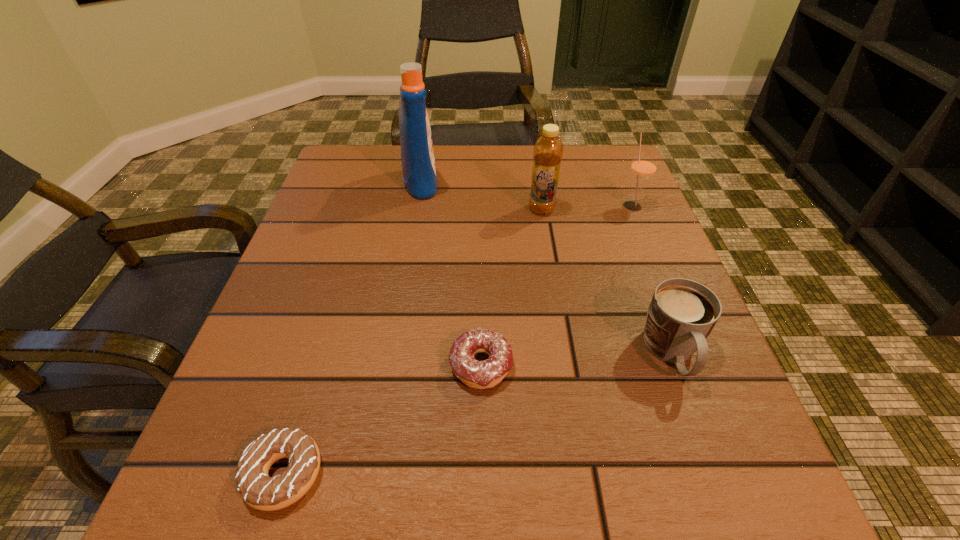
The width and height of the screenshot is (960, 540). Identify the location of free point located 0.240m on the label of the detergent. (539, 183).

Locate an element on the screen. The height and width of the screenshot is (540, 960). free region located 0.230m on the front of the fifth shortest object is located at coordinates (556, 294).

The height and width of the screenshot is (540, 960). I want to click on vacant area situated on the front of the third tallest object, so click(642, 230).

The height and width of the screenshot is (540, 960). In order to click on free region located 0.190m on the side of the mug with the handle in this screenshot , I will do 737,532.

This screenshot has width=960, height=540. In order to click on vacant point located on the right of the farther doughnut in this screenshot , I will do `click(633, 365)`.

What are the coordinates of `free point located 0.370m on the back of the nearest object` in the screenshot? It's located at (350, 257).

Where is `detergent at the far edge`? This screenshot has width=960, height=540. detergent at the far edge is located at coordinates (417, 155).

Locate an element on the screen. The width and height of the screenshot is (960, 540). straw at the far edge is located at coordinates (643, 167).

Where is `object at the near edge`? This screenshot has height=540, width=960. object at the near edge is located at coordinates (257, 489).

Locate an element on the screen. object that is positioned at the left edge is located at coordinates (257, 489).